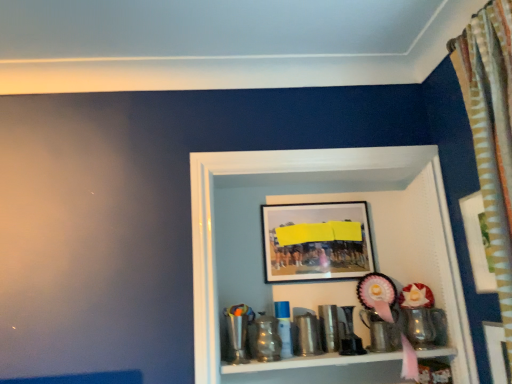
Question: In terms of size, does metallic shiny cup at lower center, which is the first toy in left-to-right order, appear bigger or smaller than metallic silver cup at lower right, the first toy when ordered from right to left?

Choices:
 (A) small
 (B) big

Answer: (B)

Question: Relative to metallic silver cup at lower right, the first toy when ordered from right to left, is metallic shiny cup at lower center, which is the first toy in left-to-right order, in front or behind?

Choices:
 (A) front
 (B) behind

Answer: (A)

Question: Estimate the real-world distances between objects in this image. Which object is closer to the metallic silver cup at lower right, the first toy when ordered from right to left?

Choices:
 (A) wooden picture frame at upper right, marked as the 2th picture frame in a left-to-right arrangement
 (B) matte black picture frame at upper center, arranged as the second picture frame when viewed from the right
 (C) metallic shiny cup at lower center, which is the first toy in left-to-right order
 (D) metallic trophy at center

Answer: (A)

Question: Which object is positioned farthest from the metallic trophy at center?

Choices:
 (A) wooden picture frame at upper right, marked as the 2th picture frame in a back-to-front arrangement
 (B) metallic silver cup at lower right, the first toy when ordered from right to left
 (C) matte black picture frame at upper center, the first picture frame when ordered from back to front
 (D) metallic shiny cup at lower center, the second toy viewed from the right

Answer: (A)